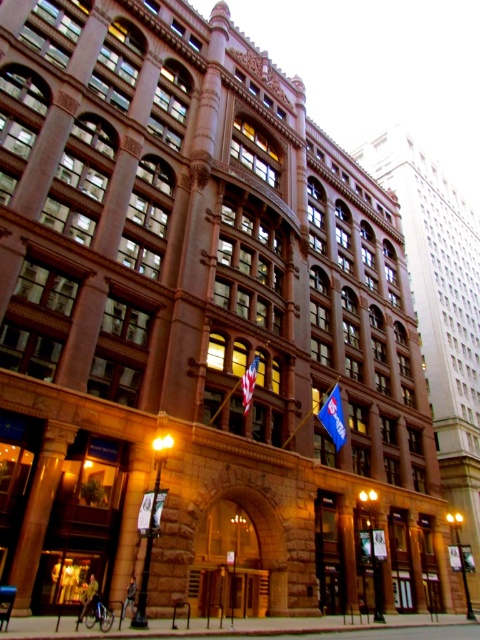
Does blue fabric flag at lower right appear on the left side of american flag at center?

No, blue fabric flag at lower right is not to the left of american flag at center.

Who is positioned more to the right, blue fabric flag at lower right or american flag at center?

From the viewer's perspective, blue fabric flag at lower right appears more on the right side.

Locate an element on the screen. This screenshot has height=640, width=480. blue fabric flag at lower right is located at coordinates 334,417.

Can you confirm if brown stone pillar at lower left is bigger than american flag at center?

Yes, brown stone pillar at lower left is bigger than american flag at center.

Is brown stone pillar at lower left shorter than american flag at center?

No.

Locate an element on the screen. The height and width of the screenshot is (640, 480). brown stone pillar at lower left is located at coordinates pyautogui.click(x=38, y=512).

Can you confirm if brown stone pillar at lower left is wider than blue fabric flag at lower right?

In fact, brown stone pillar at lower left might be narrower than blue fabric flag at lower right.

Which is behind, point (44, 461) or point (319, 419)?

The point (319, 419) is more distant.

At what (x,y) coordinates should I click in order to perform the action: click on brown stone pillar at lower left. Please return your answer as a coordinate pair (x, y). Image resolution: width=480 pixels, height=640 pixels. Looking at the image, I should click on (38, 512).